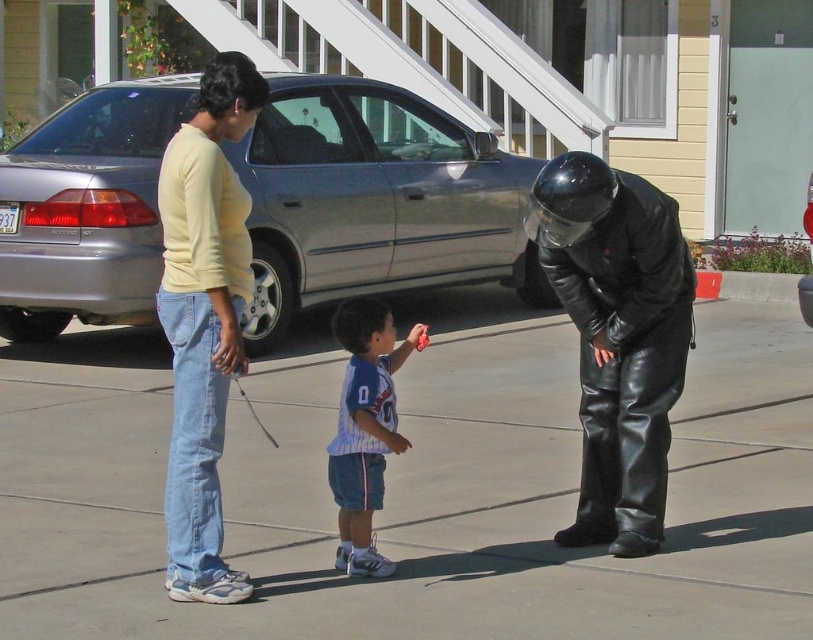
Question: Which point is closer to the camera?

Choices:
 (A) (372, 412)
 (B) (214, 372)
 (C) (80, 484)
 (D) (420, 204)

Answer: (B)

Question: Does black leather helmet at center come in front of white striped jersey at center?

Choices:
 (A) no
 (B) yes

Answer: (A)

Question: Is black leather helmet at center closer to camera compared to white striped jersey at center?

Choices:
 (A) yes
 (B) no

Answer: (B)

Question: Which point appears farthest from the camera in this image?

Choices:
 (A) (338, 330)
 (B) (46, 147)

Answer: (B)

Question: Which is nearer to the silver metallic sedan at center?

Choices:
 (A) light yellow long-sleeve shirt at center
 (B) black leather helmet at center
 (C) white striped jersey at center
 (D) smooth concrete sidewalk at center

Answer: (D)

Question: Does silver metallic sedan at center appear on the left side of light yellow long-sleeve shirt at center?

Choices:
 (A) yes
 (B) no

Answer: (B)